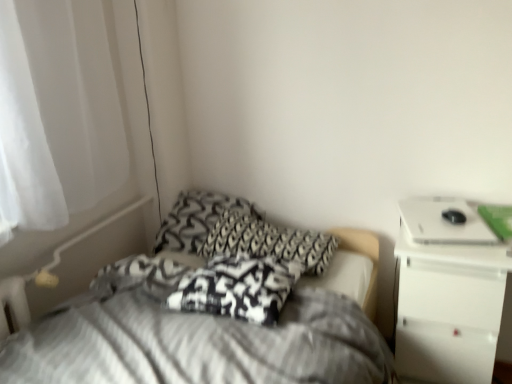
Question: Is white glossy laptop at upper right smaller than white glossy nightstand at upper right?

Choices:
 (A) no
 (B) yes

Answer: (B)

Question: From a real-world perspective, is white glossy laptop at upper right positioned under white glossy nightstand at upper right based on gravity?

Choices:
 (A) no
 (B) yes

Answer: (A)

Question: Can you confirm if white glossy laptop at upper right is thinner than white glossy nightstand at upper right?

Choices:
 (A) yes
 (B) no

Answer: (A)

Question: Is white glossy laptop at upper right positioned beyond the bounds of white glossy nightstand at upper right?

Choices:
 (A) no
 (B) yes

Answer: (B)

Question: Could you tell me if white glossy laptop at upper right is turned towards white glossy nightstand at upper right?

Choices:
 (A) yes
 (B) no

Answer: (B)

Question: Considering the positions of white glossy nightstand at upper right and white sheer curtain at left in the image, is white glossy nightstand at upper right taller or shorter than white sheer curtain at left?

Choices:
 (A) tall
 (B) short

Answer: (B)

Question: From a real-world perspective, is white glossy nightstand at upper right positioned above or below white sheer curtain at left?

Choices:
 (A) below
 (B) above

Answer: (A)

Question: Is white glossy nightstand at upper right spatially inside white sheer curtain at left, or outside of it?

Choices:
 (A) outside
 (B) inside

Answer: (A)

Question: From the image's perspective, relative to white sheer curtain at left, is white glossy nightstand at upper right above or below?

Choices:
 (A) below
 (B) above

Answer: (A)

Question: From the image's perspective, is black and white patterned pillow at center, which is the third pillow from front to back, positioned above or below textured gray bed at center?

Choices:
 (A) below
 (B) above

Answer: (B)

Question: Is black and white patterned pillow at center, which is the third pillow from front to back, bigger or smaller than textured gray bed at center?

Choices:
 (A) big
 (B) small

Answer: (B)

Question: Is black and white patterned pillow at center, acting as the first pillow starting from the back, inside or outside of textured gray bed at center?

Choices:
 (A) outside
 (B) inside

Answer: (A)

Question: Considering the positions of black and white patterned pillow at center, which is the third pillow from front to back, and textured gray bed at center in the image, is black and white patterned pillow at center, which is the third pillow from front to back, wider or thinner than textured gray bed at center?

Choices:
 (A) wide
 (B) thin

Answer: (B)

Question: Is white sheer curtain at left inside or outside of textured gray bed at center?

Choices:
 (A) outside
 (B) inside

Answer: (A)

Question: Considering the positions of point (23, 185) and point (91, 362), is point (23, 185) closer or farther from the camera than point (91, 362)?

Choices:
 (A) farther
 (B) closer

Answer: (A)